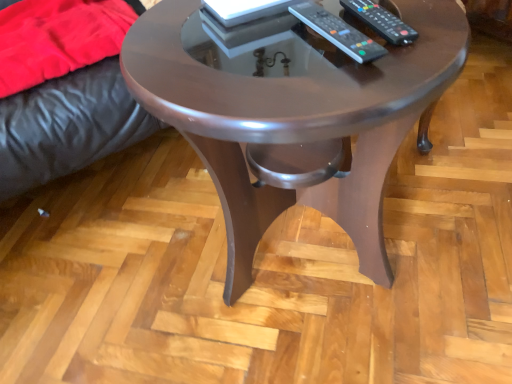
Question: Would you say shiny brown wood coffee table at center is inside or outside velvet red blanket at left?

Choices:
 (A) inside
 (B) outside

Answer: (B)

Question: Considering the positions of shiny brown wood coffee table at center and velvet red blanket at left in the image, is shiny brown wood coffee table at center bigger or smaller than velvet red blanket at left?

Choices:
 (A) small
 (B) big

Answer: (B)

Question: Which object is positioned closest to the velvet red blanket at left?

Choices:
 (A) black plastic remote at upper right, marked as the 1th remote in a right-to-left arrangement
 (B) black plastic remote at center, which is the 2th remote from right to left
 (C) shiny brown wood coffee table at center

Answer: (C)

Question: Estimate the real-world distances between objects in this image. Which object is farther from the black plastic remote at upper right, positioned as the second remote in left-to-right order?

Choices:
 (A) black plastic remote at center, which is the 2th remote from right to left
 (B) velvet red blanket at left
 (C) shiny brown wood coffee table at center

Answer: (B)